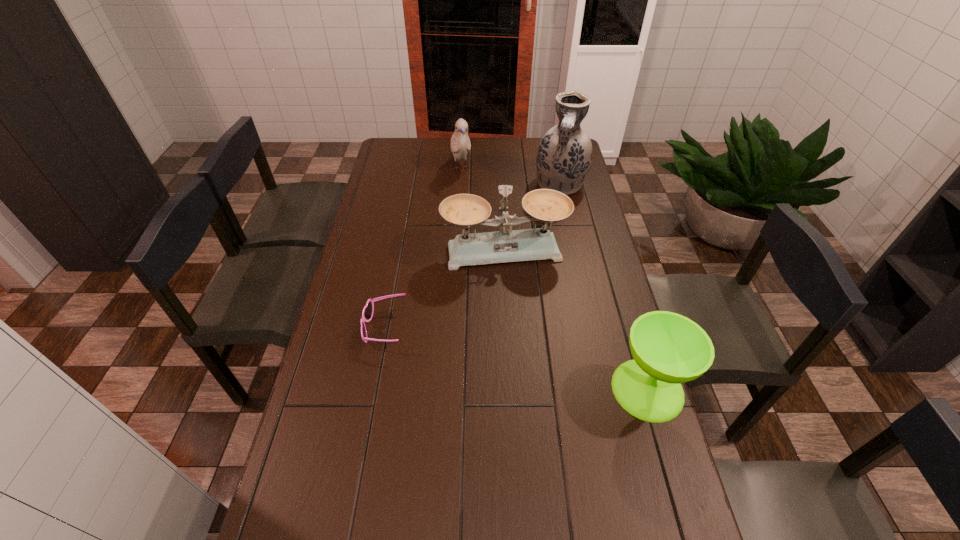
I want to click on vacant space located 0.360m with the handle on the side of the vase, so click(547, 260).

Locate an element on the screen. The height and width of the screenshot is (540, 960). free region located 0.180m with the handle on the side of the vase is located at coordinates (553, 229).

Where is `vacant area situated 0.130m on the front-facing side of the third nearest object`? The image size is (960, 540). vacant area situated 0.130m on the front-facing side of the third nearest object is located at coordinates (519, 299).

The height and width of the screenshot is (540, 960). I want to click on free region located on the front-facing side of the third nearest object, so click(x=522, y=308).

Find the location of a particular element. The height and width of the screenshot is (540, 960). free space located on the front-facing side of the third nearest object is located at coordinates (516, 284).

At what (x,y) coordinates should I click in order to perform the action: click on vacant region located 0.230m at the beak of the bird. Please return your answer as a coordinate pair (x, y). The image size is (960, 540). Looking at the image, I should click on pyautogui.click(x=472, y=214).

The width and height of the screenshot is (960, 540). I want to click on free space located 0.320m at the beak of the bird, so click(x=477, y=228).

Identify the location of vacant space located 0.380m at the beak of the bird. Image resolution: width=960 pixels, height=540 pixels. (480, 238).

Identify the location of object positioned at the far edge. (460, 143).

The image size is (960, 540). I want to click on object located at the left edge, so click(367, 313).